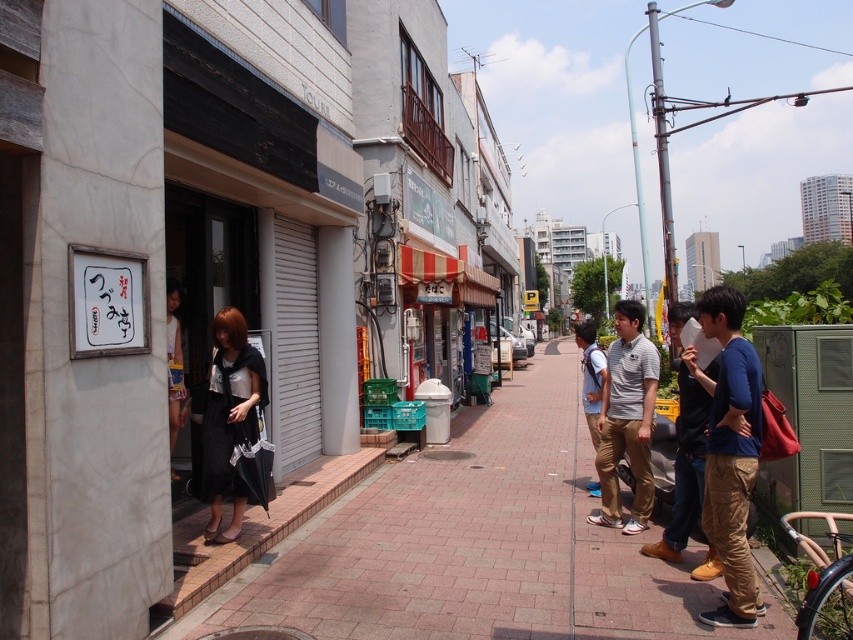
You are standing on the sidewalk and see the brick pavement at center and the black matte dress at center. Which object is closer to you?

The brick pavement at center is closer to you because it is in front of the black matte dress at center.

You are standing on the sidewalk in the image and want to take a photo of both the point at coordinates (720, 586) and the point at (610, 364) without moving your camera. Which point should you focus on first to ensure both are in sharp focus?

You should focus on the point at (610, 364) first because it is farther from the camera than the point at (720, 586). By focusing on the farther point, the closer point will also be within the depth of field, ensuring both are in sharp focus.